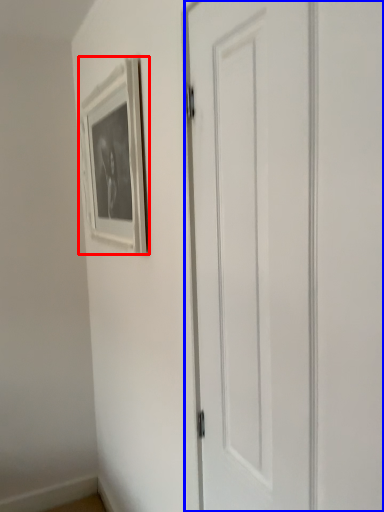
Question: Which object appears closest to the camera in this image, picture frame (highlighted by a red box) or door (highlighted by a blue box)?

Choices:
 (A) picture frame
 (B) door

Answer: (B)